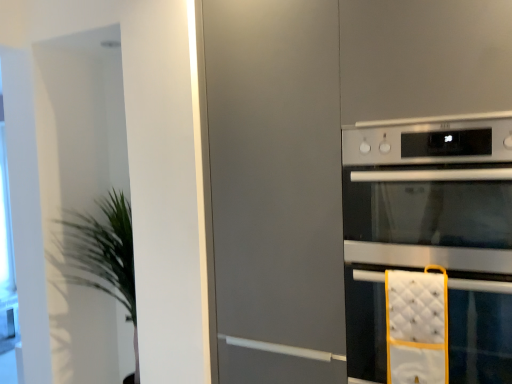
What do you see at coordinates (431, 236) in the screenshot?
I see `satin silver oven at right` at bounding box center [431, 236].

Identify the location of satin silver oven at right. (431, 236).

Would you say silver metallic oven at right contains green leafy plant at left?

No.

Looking at their sizes, would you say silver metallic oven at right is wider or thinner than green leafy plant at left?

silver metallic oven at right is wider than green leafy plant at left.

In the scene shown: Does silver metallic oven at right turn towards green leafy plant at left?

No, silver metallic oven at right is not facing towards green leafy plant at left.

Are silver metallic oven at right and green leafy plant at left far apart?

Yes, silver metallic oven at right is far from green leafy plant at left.

From a real-world perspective, between silver metallic oven at right and satin silver oven at right, who is vertically lower?

silver metallic oven at right is physically lower.

At what (x,y) coordinates should I click in order to perform the action: click on oven on the right of the satin silver oven at right. Please return your answer as a coordinate pair (x, y). Looking at the image, I should click on (479, 336).

How different are the orientations of silver metallic oven at right and satin silver oven at right in degrees?

silver metallic oven at right and satin silver oven at right are facing 0.000216 degrees away from each other.

Is point (455, 338) more distant than point (362, 240)?

No, (455, 338) is closer to viewer.

Considering the relative positions of satin silver oven at right and silver metallic oven at right in the image provided, is satin silver oven at right in front of silver metallic oven at right?

Yes, the depth of satin silver oven at right is less than that of silver metallic oven at right.

From the image's perspective, which is above, satin silver oven at right or silver metallic oven at right?

satin silver oven at right is shown above in the image.

Which object is positioned more to the left, satin silver oven at right or silver metallic oven at right?

satin silver oven at right is more to the left.

From a real-world perspective, is green leafy plant at left positioned above or below satin silver oven at right?

green leafy plant at left is situated lower than satin silver oven at right in the real world.

Can you confirm if green leafy plant at left is positioned to the right of satin silver oven at right?

No, green leafy plant at left is not to the right of satin silver oven at right.

At what (x,y) coordinates should I click in order to perform the action: click on plant behind the satin silver oven at right. Please return your answer as a coordinate pair (x, y). The image size is (512, 384). Looking at the image, I should click on (103, 256).

Considering the relative sizes of green leafy plant at left and satin silver oven at right in the image provided, is green leafy plant at left wider than satin silver oven at right?

No.

In the scene shown: Which object is thinner, green leafy plant at left or silver metallic oven at right?

With smaller width is green leafy plant at left.

Is green leafy plant at left looking in the opposite direction of silver metallic oven at right?

No.

What's the angular difference between green leafy plant at left and silver metallic oven at right's facing directions?

0.394 degrees.

Considering the positions of objects green leafy plant at left and silver metallic oven at right in the image provided, who is in front, green leafy plant at left or silver metallic oven at right?

silver metallic oven at right is in front.

Does satin silver oven at right have a smaller size compared to green leafy plant at left?

Yes, satin silver oven at right is smaller than green leafy plant at left.

Can you confirm if satin silver oven at right is thinner than green leafy plant at left?

No, satin silver oven at right is not thinner than green leafy plant at left.

Is satin silver oven at right looking in the opposite direction of green leafy plant at left?

No, satin silver oven at right's orientation is not away from green leafy plant at left.

The width and height of the screenshot is (512, 384). In order to click on oven above the green leafy plant at left (from the image's perspective) in this screenshot , I will do `click(479, 336)`.

At what (x,y) coordinates should I click in order to perform the action: click on home appliance on the left of silver metallic oven at right. Please return your answer as a coordinate pair (x, y). Looking at the image, I should click on (431, 236).

In the scene shown: Estimate the real-world distances between objects in this image. Which object is further from silver metallic oven at right, satin silver oven at right or green leafy plant at left?

Based on the image, green leafy plant at left appears to be further to silver metallic oven at right.

Estimate the real-world distances between objects in this image. Which object is further from green leafy plant at left, satin silver oven at right or silver metallic oven at right?

Based on the image, silver metallic oven at right appears to be further to green leafy plant at left.

From the image, which object appears to be farther from satin silver oven at right, silver metallic oven at right or green leafy plant at left?

Based on the image, green leafy plant at left appears to be further to satin silver oven at right.

Estimate the real-world distances between objects in this image. Which object is further from silver metallic oven at right, green leafy plant at left or satin silver oven at right?

Among the two, green leafy plant at left is located further to silver metallic oven at right.

Considering their positions, is green leafy plant at left positioned further to satin silver oven at right than silver metallic oven at right?

Based on the image, green leafy plant at left appears to be further to satin silver oven at right.

Which object lies further to the anchor point green leafy plant at left, silver metallic oven at right or satin silver oven at right?

silver metallic oven at right is positioned further to the anchor green leafy plant at left.

Where is `home appliance between green leafy plant at left and silver metallic oven at right`? The image size is (512, 384). home appliance between green leafy plant at left and silver metallic oven at right is located at coordinates (431, 236).